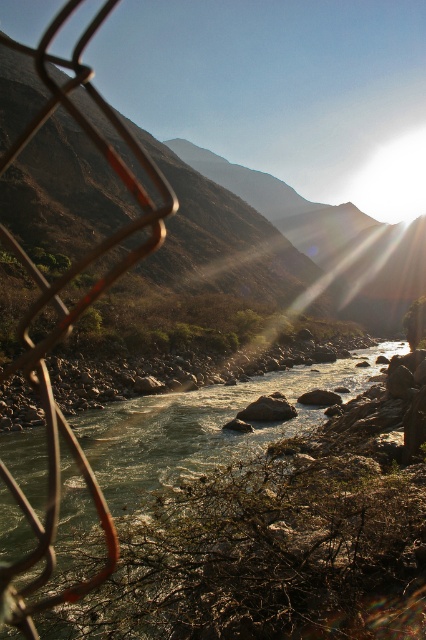
Question: Which point is farther to the camera?

Choices:
 (A) greenish-brown rocky stream at center
 (B) brown/dry grassy mountain at upper center

Answer: (B)

Question: Which point appears closest to the camera in this image?

Choices:
 (A) (218, 182)
 (B) (115, 460)

Answer: (B)

Question: Can you confirm if greenish-brown rocky stream at center is positioned above brown/dry grassy mountain at upper center?

Choices:
 (A) yes
 (B) no

Answer: (B)

Question: Is greenish-brown rocky stream at center positioned in front of brown/dry grassy mountain at upper center?

Choices:
 (A) yes
 (B) no

Answer: (A)

Question: Is greenish-brown rocky stream at center smaller than brown/dry grassy mountain at upper center?

Choices:
 (A) no
 (B) yes

Answer: (B)